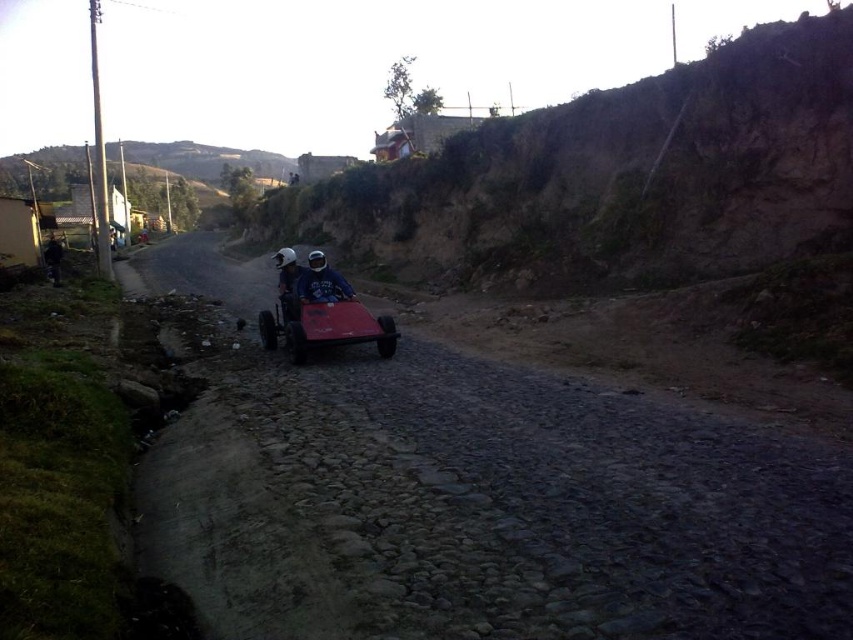
Question: Which point is closer to the camera?

Choices:
 (A) coord(326,307)
 (B) coord(277,275)
 (C) coord(340,294)

Answer: (A)

Question: Does dirt track at center appear on the right side of matte white helmet at center?

Choices:
 (A) yes
 (B) no

Answer: (A)

Question: Which point is closer to the camera taking this photo?

Choices:
 (A) (287, 310)
 (B) (309, 260)

Answer: (A)

Question: Does dirt track at center have a larger size compared to matte white helmet at center?

Choices:
 (A) no
 (B) yes

Answer: (B)

Question: Does matte blue helmet at center have a lesser width compared to matte white helmet at center?

Choices:
 (A) yes
 (B) no

Answer: (B)

Question: Estimate the real-world distances between objects in this image. Which object is farther from the matte blue helmet at center?

Choices:
 (A) matte white helmet at center
 (B) dirt track at center
 (C) shiny red toy car at center

Answer: (B)